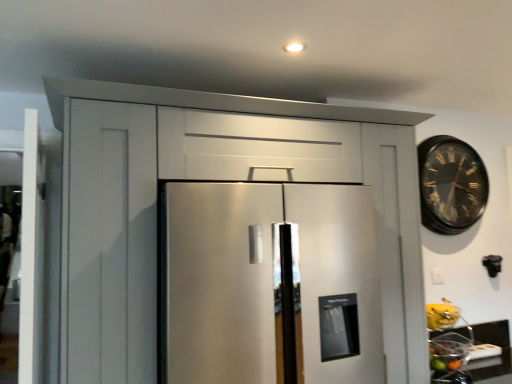
Question: Considering the positions of point (98, 96) and point (436, 340), is point (98, 96) closer or farther from the camera than point (436, 340)?

Choices:
 (A) closer
 (B) farther

Answer: (A)

Question: In terms of width, does satin white cabinet at center look wider or thinner when compared to shiny metallic bowl at lower right, which ranks as the second fruit in top-to-bottom order?

Choices:
 (A) wide
 (B) thin

Answer: (A)

Question: Considering the real-world distances, which object is farthest from the satin white cabinet at center?

Choices:
 (A) shiny metallic bowl at lower right, the first fruit when ordered from bottom to top
 (B) yellow matte bananas at lower right, the 2th fruit when ordered from bottom to top
 (C) gold-toned metal clock at upper right
 (D) stainless steel refrigerator at center
 (E) matte black countertop at lower right

Answer: (E)

Question: Estimate the real-world distances between objects in this image. Which object is farther from the matte black countertop at lower right?

Choices:
 (A) gold-toned metal clock at upper right
 (B) shiny metallic bowl at lower right, which ranks as the second fruit in top-to-bottom order
 (C) satin white cabinet at center
 (D) stainless steel refrigerator at center
 (E) yellow matte bananas at lower right, the 2th fruit when ordered from bottom to top

Answer: (D)